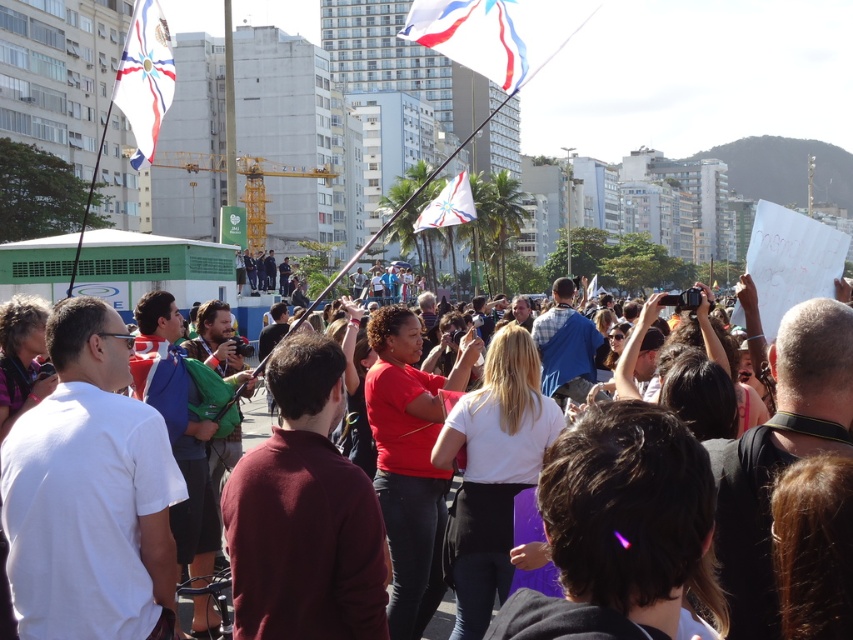
Question: Does white fabric flag at upper center have a greater width compared to white fabric flag at center?

Choices:
 (A) no
 (B) yes

Answer: (A)

Question: Which of the following is the farthest from the observer?

Choices:
 (A) matte black camera at center
 (B) white fabric flag at upper center
 (C) white fabric flag at center

Answer: (C)

Question: Among these points, which one is nearest to the camera?

Choices:
 (A) (260, 428)
 (B) (134, 161)
 (C) (489, 32)

Answer: (C)

Question: Is white fabric flag at upper left closer to the viewer compared to white fabric flag at center?

Choices:
 (A) no
 (B) yes

Answer: (B)

Question: Is white fabric flag at upper center closer to camera compared to matte black camera at center?

Choices:
 (A) no
 (B) yes

Answer: (A)

Question: Which of the following is the closest to the observer?

Choices:
 (A) white fabric flag at upper center
 (B) white fabric flag at center

Answer: (A)